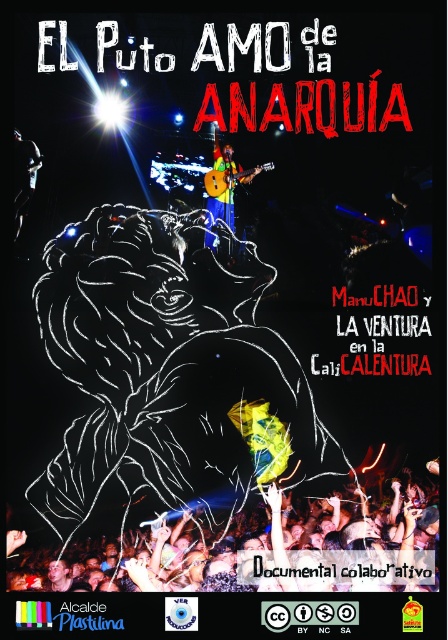
Question: Is matte black crowd at lower center smaller than green fabric guitar at upper center?

Choices:
 (A) no
 (B) yes

Answer: (A)

Question: Does matte black crowd at lower center have a larger size compared to green fabric guitar at upper center?

Choices:
 (A) no
 (B) yes

Answer: (B)

Question: Which object is closer to the camera taking this photo?

Choices:
 (A) green fabric guitar at upper center
 (B) matte black crowd at lower center

Answer: (B)

Question: Which point is closer to the camera?

Choices:
 (A) green fabric guitar at upper center
 (B) matte black crowd at lower center

Answer: (B)

Question: Is matte black crowd at lower center to the left of green fabric guitar at upper center from the viewer's perspective?

Choices:
 (A) no
 (B) yes

Answer: (B)

Question: Which point is farther to the camera?

Choices:
 (A) green fabric guitar at upper center
 (B) matte black crowd at lower center

Answer: (A)